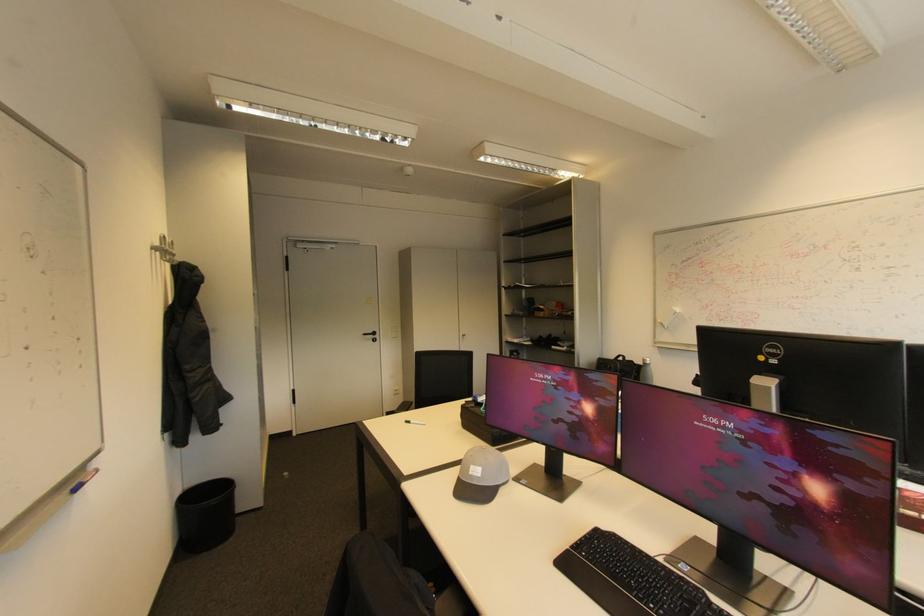
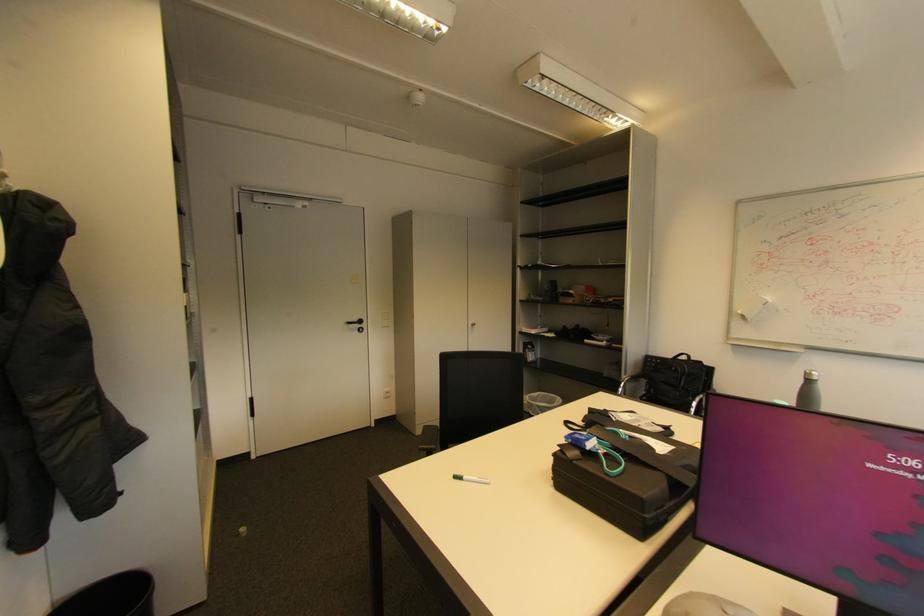
Locate, in the second image, the point that corresponds to pixel 412 423 in the first image.

(460, 477)